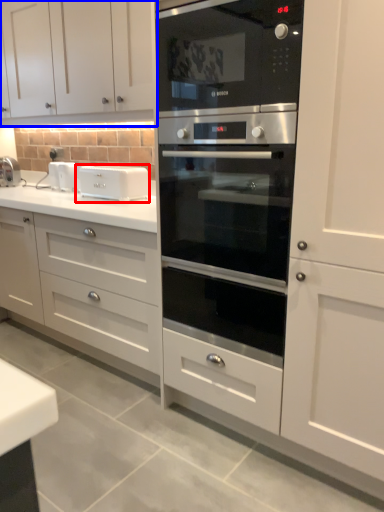
Question: Among these objects, which one is nearest to the camera, appliance (highlighted by a red box) or cabinetry (highlighted by a blue box)?

Choices:
 (A) appliance
 (B) cabinetry

Answer: (B)